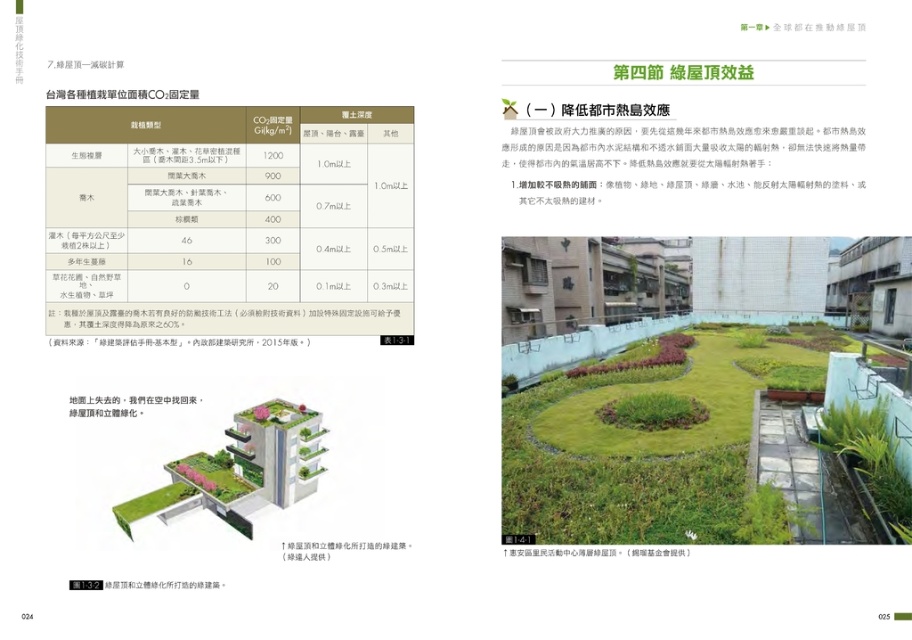
Does green grass at upper center have a lesser height compared to green grass at center?

No, green grass at upper center is not shorter than green grass at center.

Which is behind, point (556, 458) or point (638, 422)?

Positioned behind is point (638, 422).

Who is more forward, (531, 515) or (692, 406)?

Point (531, 515)

Where is `green grass at upper center`? The height and width of the screenshot is (640, 912). green grass at upper center is located at coordinates (633, 452).

Does green grass at upper center lie in front of green leafy plant at upper center?

No, green grass at upper center is behind green leafy plant at upper center.

Can you confirm if green grass at upper center is bigger than green leafy plant at upper center?

Indeed, green grass at upper center has a larger size compared to green leafy plant at upper center.

At what (x,y) coordinates should I click in order to perform the action: click on green grass at upper center. Please return your answer as a coordinate pair (x, y). Looking at the image, I should click on (633, 452).

Is green leafy plant at upper center below green grass at center?

→ Incorrect, green leafy plant at upper center is not positioned below green grass at center.

Who is positioned more to the left, green leafy plant at upper center or green grass at center?

From the viewer's perspective, green grass at center appears more on the left side.

Which is in front, point (867, 512) or point (603, 406)?

Point (867, 512)

Identify the location of green leafy plant at upper center. The height and width of the screenshot is (640, 912). (869, 460).